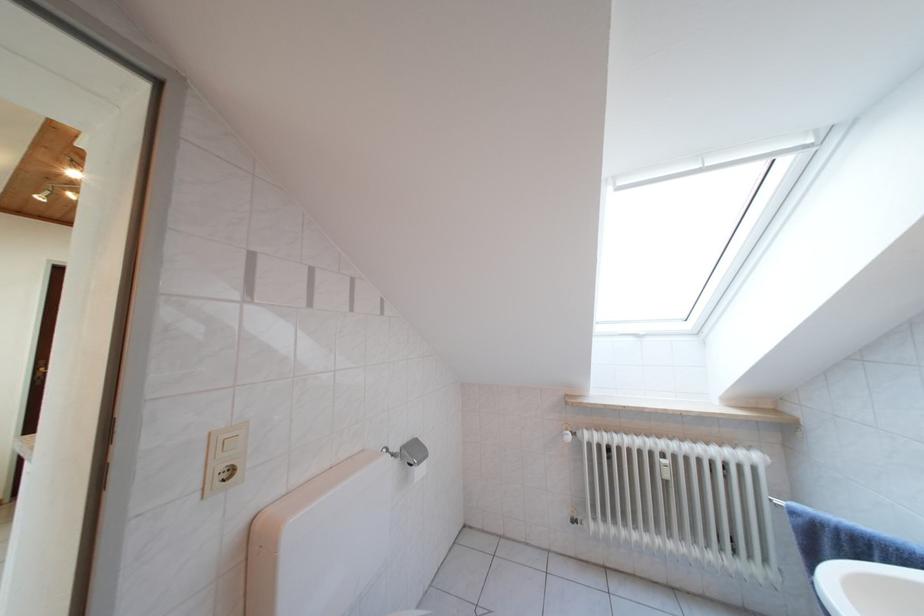
Locate an element on the screen. The height and width of the screenshot is (616, 924). white light switch is located at coordinates (225, 458).